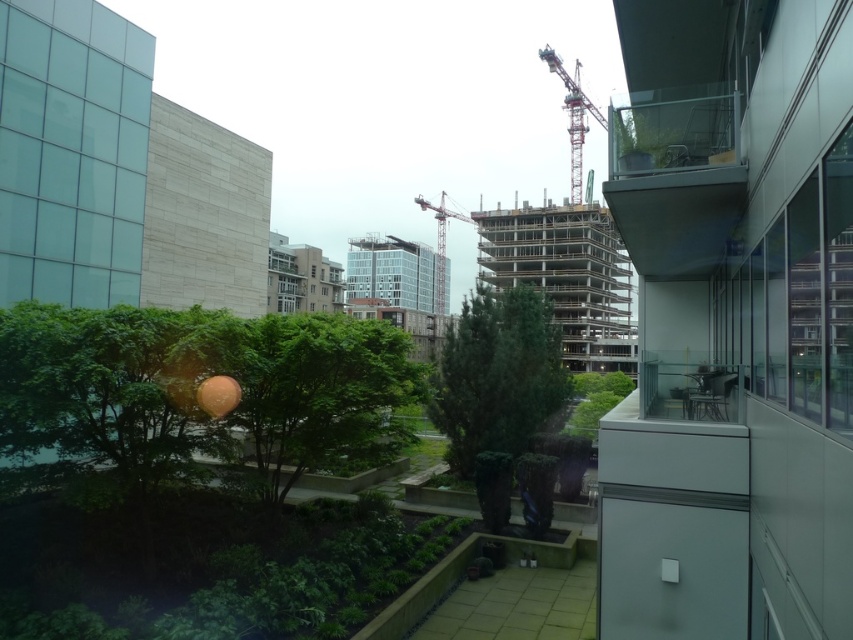
Question: Is green textured tree at center above metallic construction crane at center?

Choices:
 (A) yes
 (B) no

Answer: (B)

Question: Is green leafy tree at center thinner than red metal crane at center?

Choices:
 (A) no
 (B) yes

Answer: (B)

Question: Estimate the real-world distances between objects in this image. Which object is farther from the metallic construction crane at center?

Choices:
 (A) red metal crane at center
 (B) green leafy tree at center
 (C) green textured tree at center

Answer: (B)

Question: Based on their relative distances, which object is farther from the green leafy tree at center?

Choices:
 (A) red metal crane at center
 (B) green textured tree at center

Answer: (A)

Question: Which point is farther from the camera taking this photo?

Choices:
 (A) (479, 404)
 (B) (553, 56)
 (C) (444, 307)
 (D) (357, 332)

Answer: (C)

Question: Is red metal crane at center to the left of metallic construction crane at center from the viewer's perspective?

Choices:
 (A) yes
 (B) no

Answer: (B)